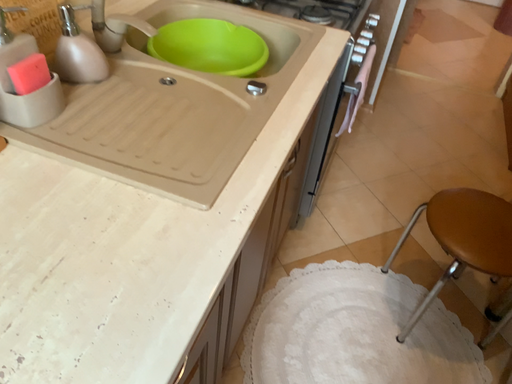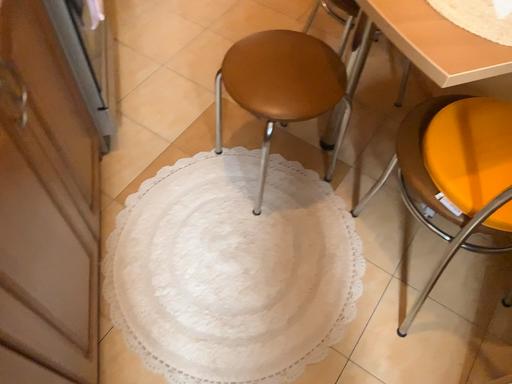
Question: Which way did the camera rotate in the video?

Choices:
 (A) rotated downward
 (B) rotated upward

Answer: (A)